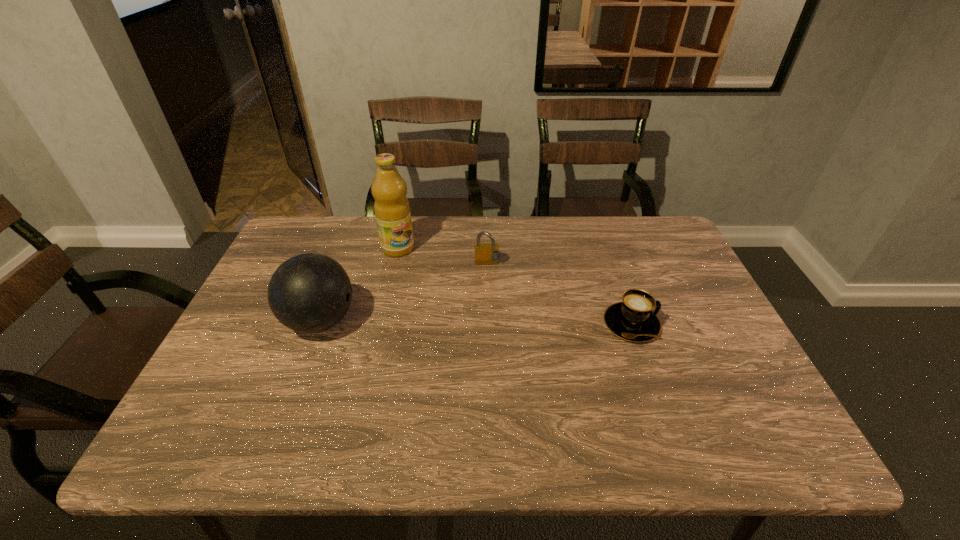
Find the location of a particular element. This screenshot has width=960, height=540. free spot on the desktop that is between the third shortest object and the rightmost object and is positioned on the side with the combination dials of the second shortest object is located at coordinates (497, 322).

Identify the location of vacant space on the desktop that is between the bowling ball and the cappuccino and is positioned on the label of the farthest object. (456, 322).